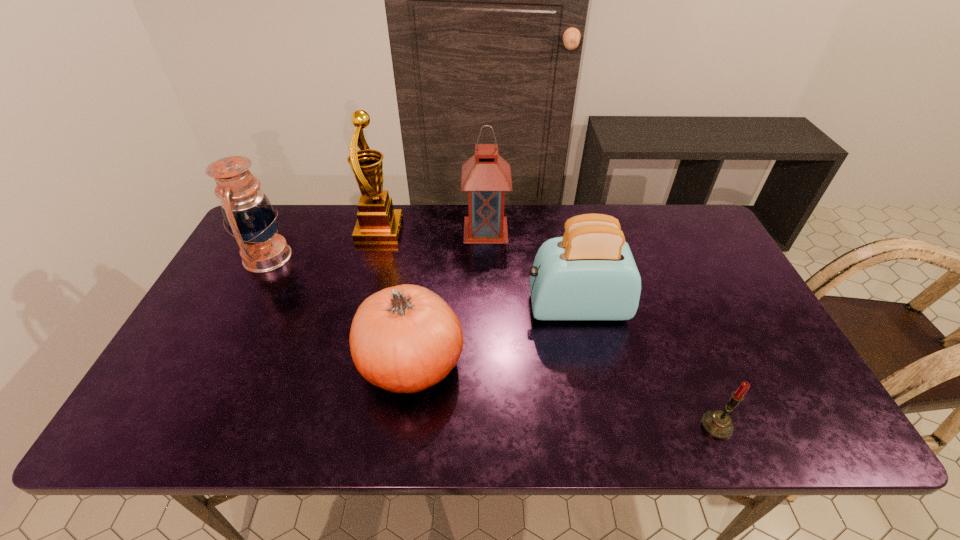
This screenshot has height=540, width=960. I want to click on award, so click(x=377, y=222).

Where is `lantern`? lantern is located at coordinates (486, 176).

In order to click on oil lamp in this screenshot , I will do `click(248, 213)`.

Identify the location of toaster. (x=588, y=274).

In order to click on the second shortest object in this screenshot , I will do `click(404, 339)`.

The image size is (960, 540). In order to click on the nearest object in this screenshot , I will do `click(718, 424)`.

Find the location of a particular element. The image size is (960, 540). the rightmost object is located at coordinates (718, 424).

I want to click on free region located 0.320m on the front-facing side of the award, so click(499, 230).

Find the location of a particular element. Image resolution: width=960 pixels, height=540 pixels. vacant space located on the left of the lantern is located at coordinates (447, 230).

Identify the location of vacant region located on the right of the leftmost object. (350, 256).